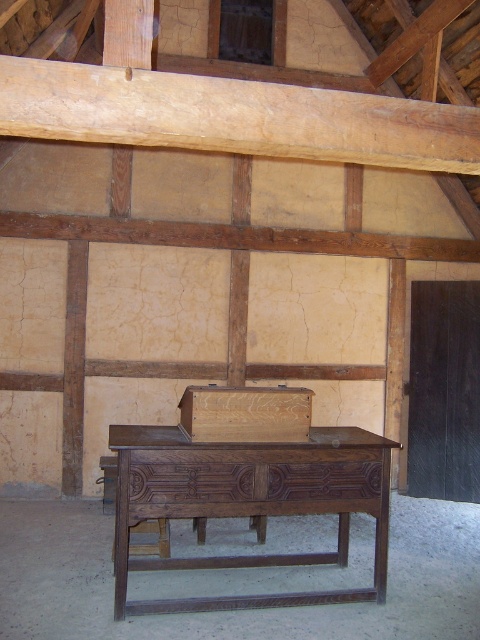
Between point (415, 120) and point (149, 563), which one is positioned behind?

The point (149, 563) is more distant.

Can you confirm if light brown wooden beam at upper center is smaller than dark wood table at center?

Yes, light brown wooden beam at upper center is smaller than dark wood table at center.

Who is more forward, (383, 147) or (216, 452)?

Positioned in front is point (383, 147).

You are a GUI agent. You are given a task and a screenshot of the screen. Output one action in this format:
    pyautogui.click(x=<x>, y=<y>)
    Task: Click on the light brown wooden beam at upper center
    
    Given the screenshot: What is the action you would take?
    pyautogui.click(x=232, y=116)